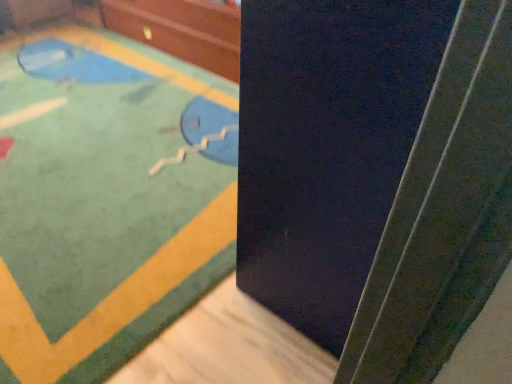
This screenshot has height=384, width=512. What are the coordinates of `dark wood door at right` in the screenshot? It's located at (376, 174).

The height and width of the screenshot is (384, 512). What do you see at coordinates (376, 174) in the screenshot? I see `dark wood door at right` at bounding box center [376, 174].

Locate an element on the screen. Image resolution: width=512 pixels, height=384 pixels. dark wood door at right is located at coordinates (376, 174).